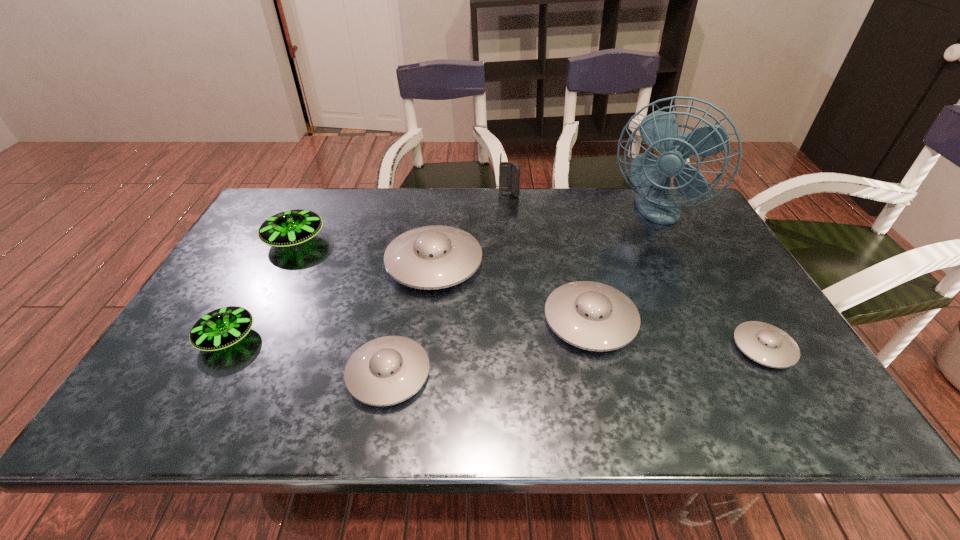
Locate an element on the screen. This screenshot has height=540, width=960. free spot that satisfies the following two spatial constraints: 1. on the back side of the third smallest gray saucer; 2. on the left side of the nearer green saucer is located at coordinates (237, 320).

This screenshot has height=540, width=960. I want to click on vacant region that satisfies the following two spatial constraints: 1. on the keyboard of the second gray saucer from right to left; 2. on the right side of the second tallest object, so click(x=520, y=320).

The width and height of the screenshot is (960, 540). I want to click on vacant space that satisfies the following two spatial constraints: 1. on the front side of the farther green saucer; 2. on the right side of the rightmost gray saucer, so click(240, 348).